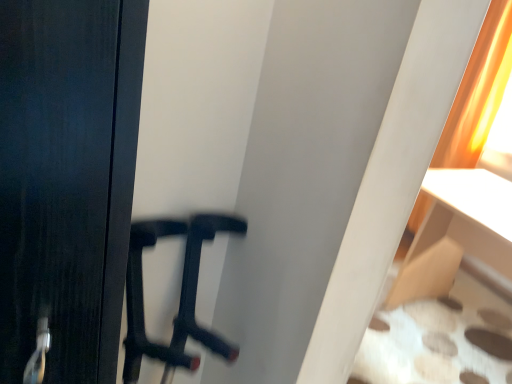
Question: In terms of size, does orange fabric curtain at upper right appear bigger or smaller than white fabric ottoman at lower right?

Choices:
 (A) big
 (B) small

Answer: (B)

Question: Considering the relative positions of orange fabric curtain at upper right and white fabric ottoman at lower right in the image provided, is orange fabric curtain at upper right to the left or to the right of white fabric ottoman at lower right?

Choices:
 (A) right
 (B) left

Answer: (A)

Question: Considering the positions of orange fabric curtain at upper right and white fabric ottoman at lower right in the image, is orange fabric curtain at upper right taller or shorter than white fabric ottoman at lower right?

Choices:
 (A) short
 (B) tall

Answer: (B)

Question: Is point (436, 183) closer or farther from the camera than point (501, 77)?

Choices:
 (A) closer
 (B) farther

Answer: (A)

Question: In terms of size, does white fabric ottoman at lower right appear bigger or smaller than orange fabric curtain at upper right?

Choices:
 (A) small
 (B) big

Answer: (B)

Question: Considering their positions, is white fabric ottoman at lower right located in front of or behind orange fabric curtain at upper right?

Choices:
 (A) behind
 (B) front

Answer: (B)

Question: Is white fabric ottoman at lower right taller or shorter than orange fabric curtain at upper right?

Choices:
 (A) tall
 (B) short

Answer: (B)